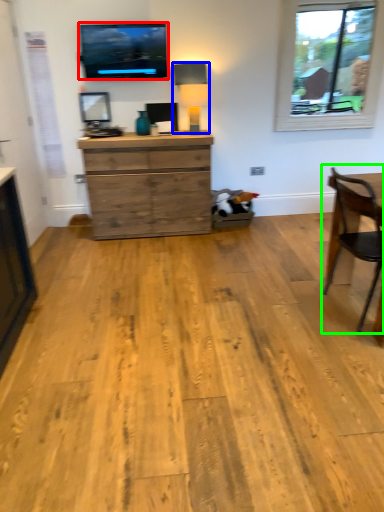
Question: Which is farther away from television (highlighted by a red box)? lamp (highlighted by a blue box) or chair (highlighted by a green box)?

Choices:
 (A) lamp
 (B) chair

Answer: (B)